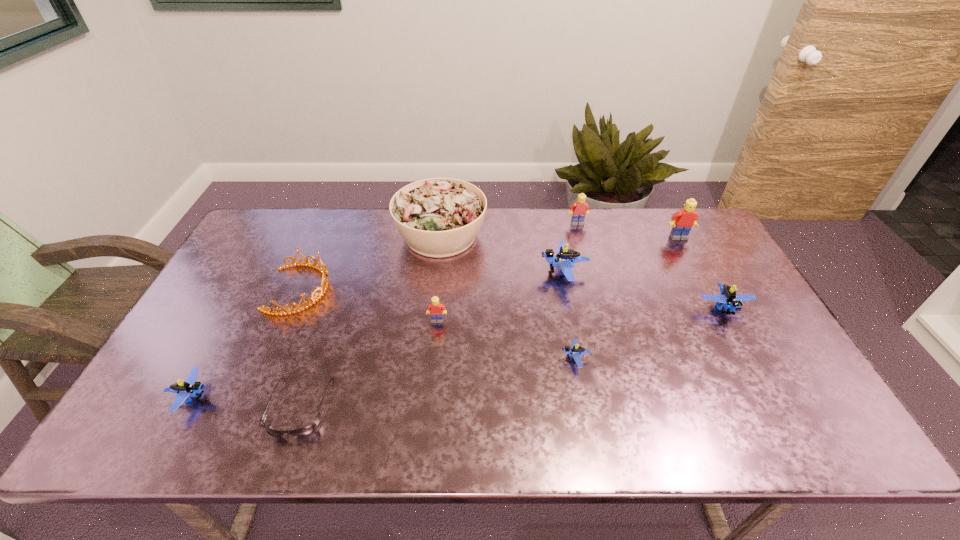
In the image, there is a desktop. Identify the location of blank space at the far right corner. pos(701,232).

This screenshot has height=540, width=960. Identify the location of free area in between the second nearest blue Lego and the second nearest yellow Lego. (627, 298).

Find the location of `free space between the shortest object and the second Lego from left to right`. free space between the shortest object and the second Lego from left to right is located at coordinates (369, 363).

This screenshot has height=540, width=960. I want to click on free area in between the tallest Lego and the sixth Lego from right to left, so click(558, 279).

Where is `free space between the salad and the smallest yellow Lego`? This screenshot has width=960, height=540. free space between the salad and the smallest yellow Lego is located at coordinates (439, 278).

Find the location of `vacant region between the smallest yellow Lego and the salad`. vacant region between the smallest yellow Lego and the salad is located at coordinates (439, 278).

The width and height of the screenshot is (960, 540). I want to click on free space between the rightmost blue Lego and the nearest Lego, so click(458, 353).

Image resolution: width=960 pixels, height=540 pixels. In order to click on unoccupied position between the biggest blue Lego and the second nearest blue Lego in this screenshot , I will do `click(569, 316)`.

Locate which object is the fifth closest to the second yellow Lego from left to right. Please provide its 2D coordinates. Your answer should be formatted as a tuple, i.e. [(x, y)], where the tuple contains the x and y coordinates of a point satisfying the conditions above.

[(576, 352)]

Locate which object is the sixth closest to the tiara. Please provide its 2D coordinates. Your answer should be formatted as a tuple, i.e. [(x, y)], where the tuple contains the x and y coordinates of a point satisfying the conditions above.

[(576, 352)]